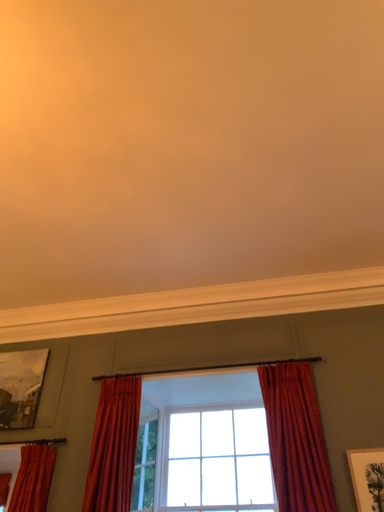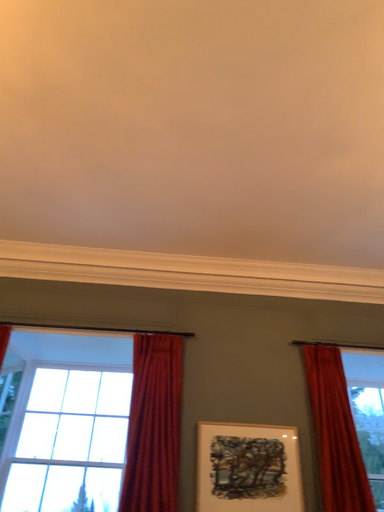
Question: How did the camera likely rotate when shooting the video?

Choices:
 (A) rotated right
 (B) rotated left

Answer: (A)